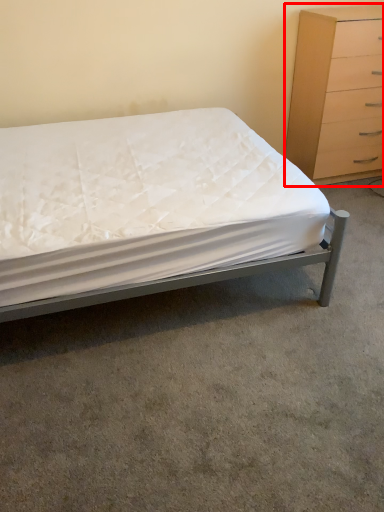
Question: From the image's perspective, considering the relative positions of chest of drawers (annotated by the red box) and bed in the image provided, where is chest of drawers (annotated by the red box) located with respect to the staircase?

Choices:
 (A) below
 (B) above

Answer: (B)